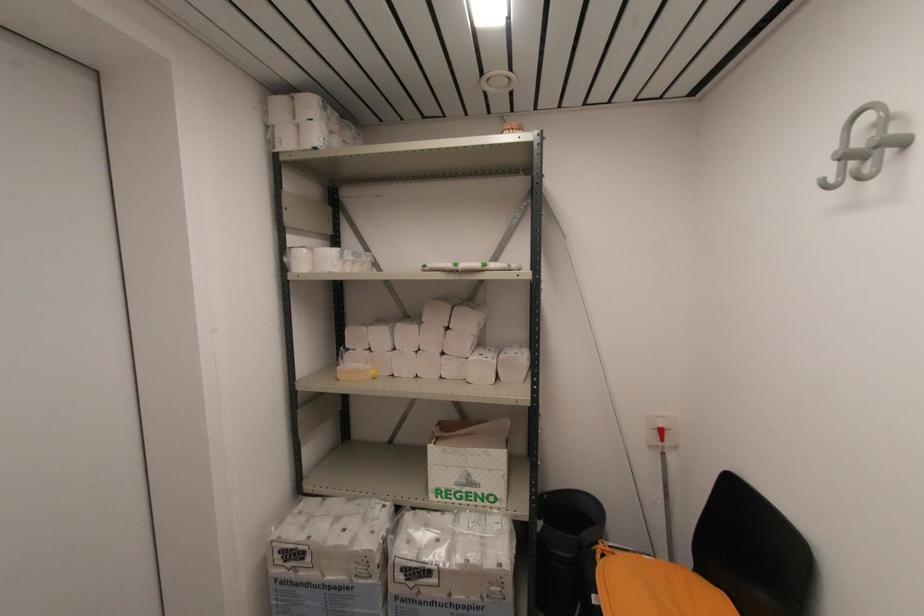
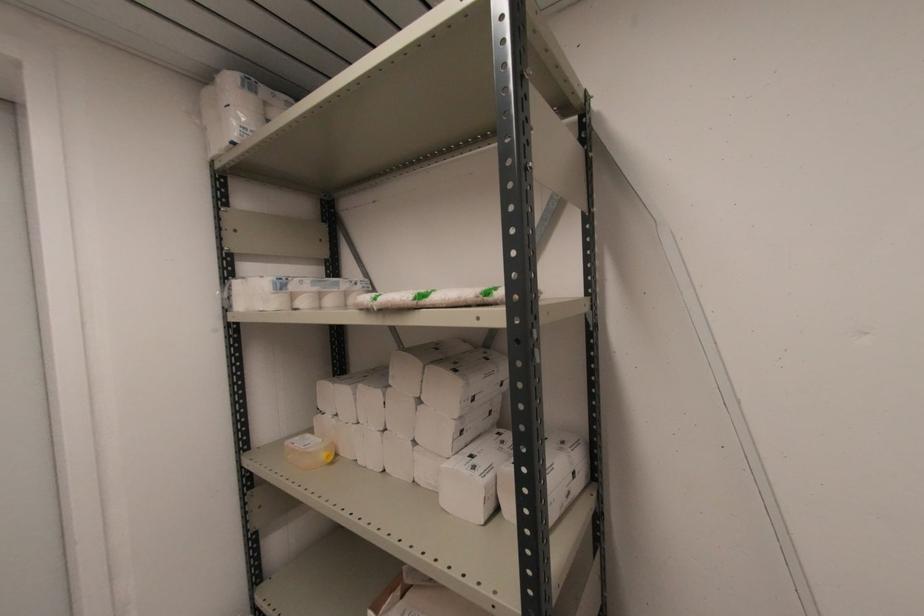
Locate, in the second image, the point that corresponds to (x=310, y=148) in the first image.

(227, 144)